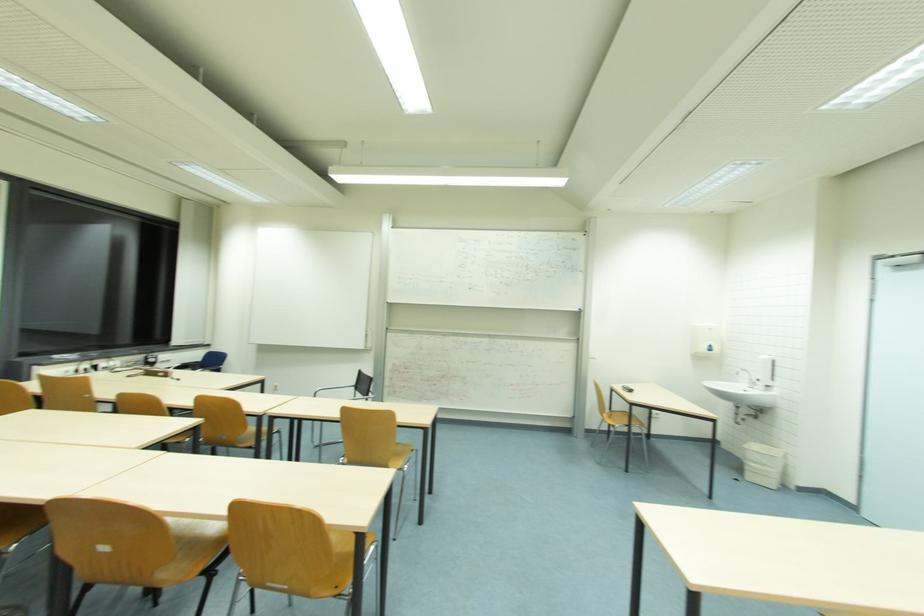
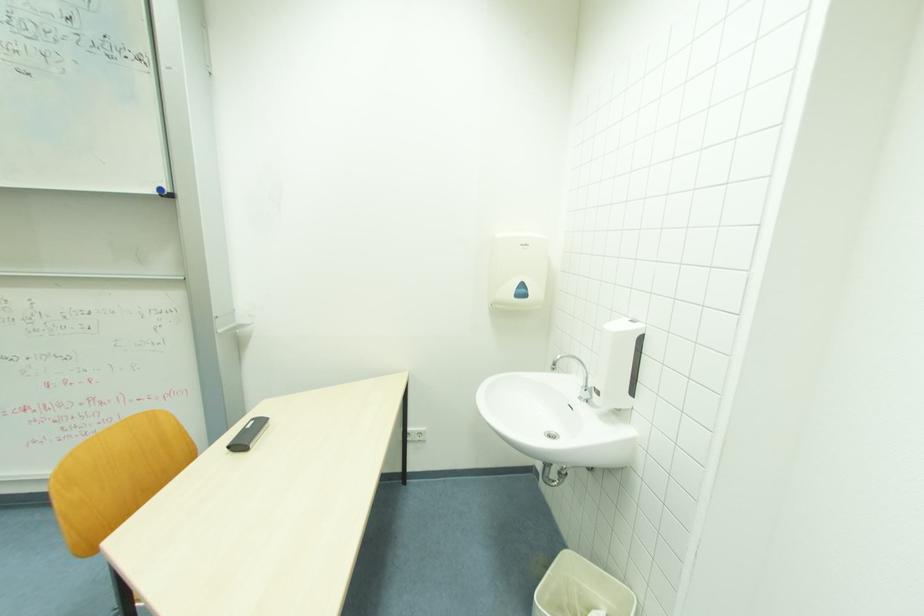
What movement of the cameraman would produce the second image?

The cameraman moved toward right, forward.